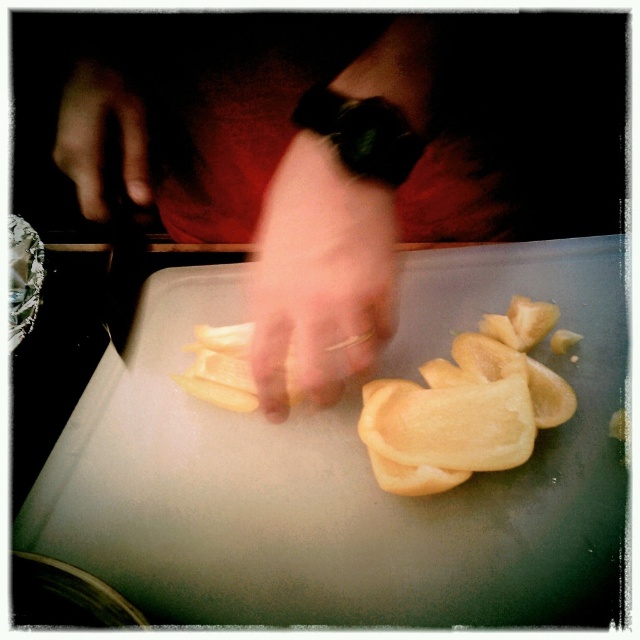
You are a chef preparing a dish and see the yellow matte onion at center and the pale skin at center on the cutting board. Which one is located to the left when looking at the cutting board?

The yellow matte onion at center is positioned on the left side of the pale skin at center, so it is located to the left.

You are preparing a salad and have both the yellow matte onion at center and the yellow matte apple slices at center on your cutting board. Which one do you need to dice smaller to ensure uniformity in size?

The yellow matte onion at center is larger than the yellow matte apple slices at center, so you should dice the yellow matte onion at center smaller to match the size of the apple slices.